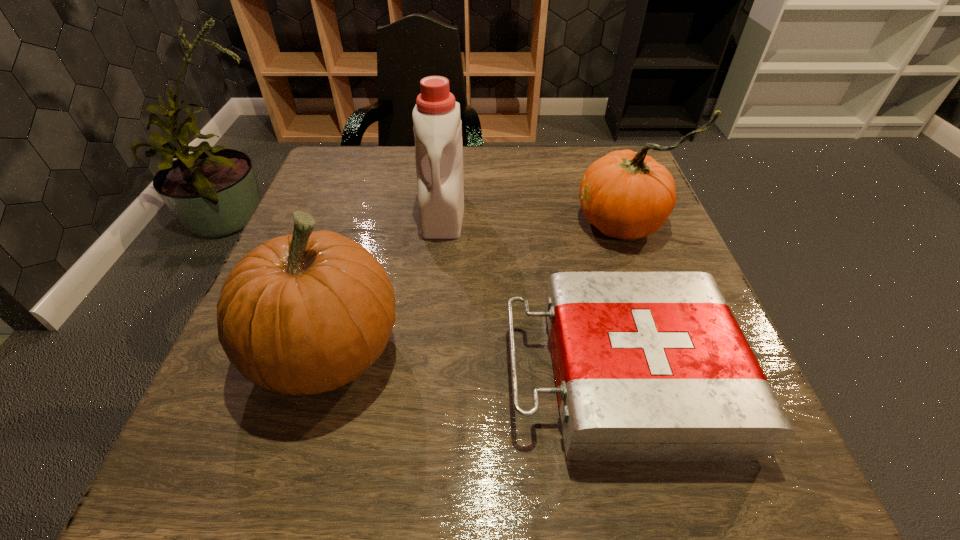
Where is `detergent`? The image size is (960, 540). detergent is located at coordinates (437, 127).

I want to click on the right pumpkin, so click(x=627, y=195).

Identify the location of the left pumpkin. The width and height of the screenshot is (960, 540). (306, 313).

This screenshot has height=540, width=960. What are the coordinates of `the shortest object` in the screenshot? It's located at (649, 366).

Identify the location of vacant space located on the handle side of the detergent. (434, 305).

You are a GUI agent. You are given a task and a screenshot of the screen. Output one action in this format:
    pyautogui.click(x=<x>, y=<y>)
    Task: Click on the vacant position located 0.280m on the front of the right pumpkin
    The height and width of the screenshot is (540, 960).
    Given the screenshot: What is the action you would take?
    pyautogui.click(x=674, y=370)

What are the coordinates of `free space located on the stem of the left pumpkin` in the screenshot? It's located at (578, 351).

Locate an element on the screen. This screenshot has width=960, height=540. blank space located 0.070m on the front side of the first-aid kit is located at coordinates (464, 375).

The image size is (960, 540). Identify the location of vacant area located 0.210m on the front side of the first-aid kit. (376, 375).

You are a GUI agent. You are given a task and a screenshot of the screen. Output one action in this format:
    pyautogui.click(x=<x>, y=<y>)
    Task: Click on the vacant space located on the front side of the first-aid kit
    
    Given the screenshot: What is the action you would take?
    pyautogui.click(x=325, y=375)